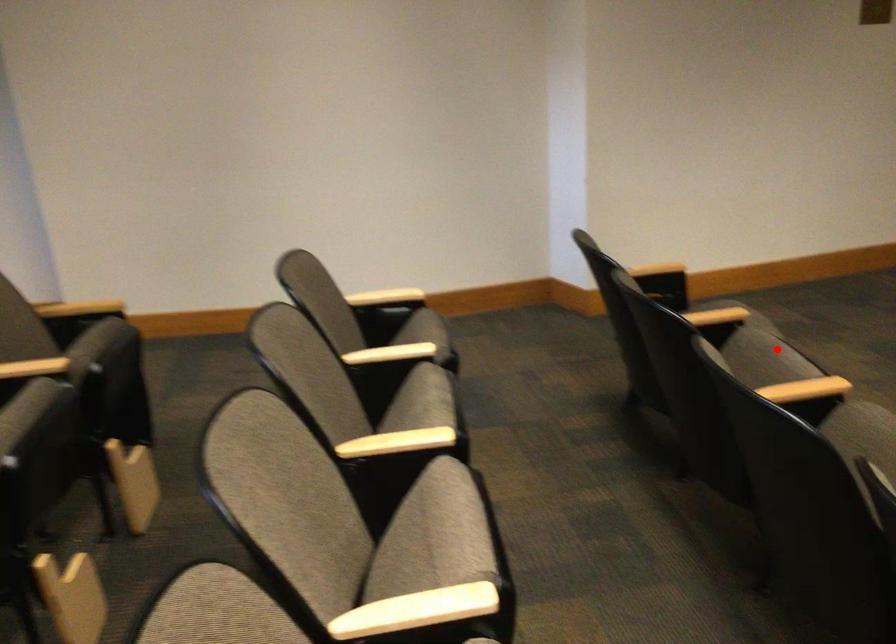
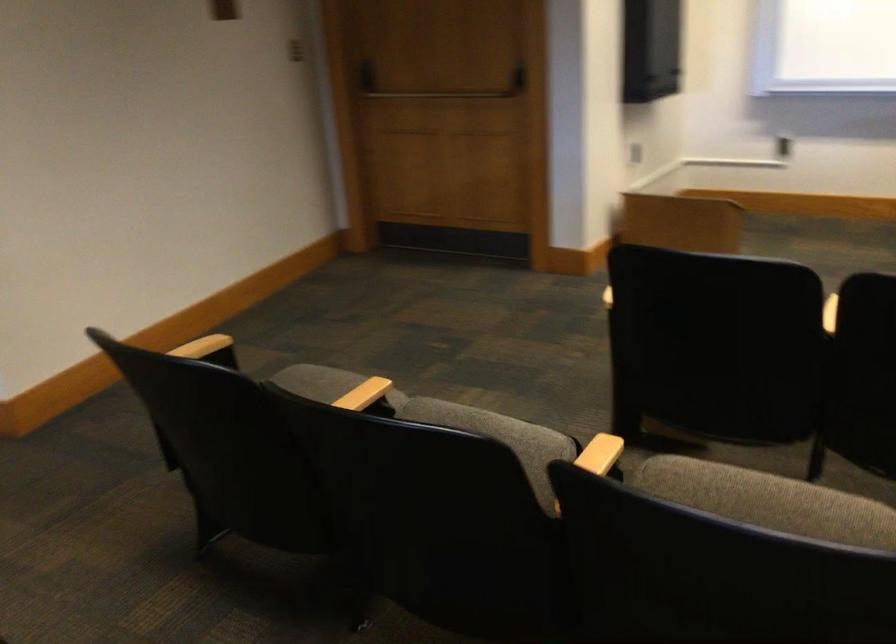
Question: I am providing you with two images of the same scene from different viewpoints. In image1, a red point is highlighted. Considering the same 3D point in image2, which of the following is correct?

Choices:
 (A) It is closer
 (B) It is farther

Answer: (A)